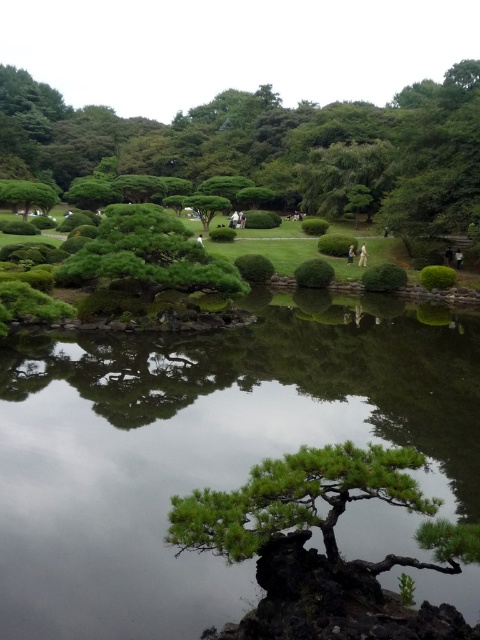
From the picture: Is green textured tree at center in front of green textured bush at center?

That is True.

Looking at this image, which of these two, green textured tree at center or green textured bush at center, stands taller?

With more height is green textured bush at center.

Between point (216, 506) and point (116, 209), which one is positioned behind?

Positioned behind is point (116, 209).

This screenshot has height=640, width=480. I want to click on green textured tree at center, so click(317, 508).

Is green leafy bush at upper center thinner than green textured tree at center?

Incorrect, green leafy bush at upper center's width is not less than green textured tree at center's.

Which is below, green leafy bush at upper center or green textured tree at center?

→ Positioned lower is green textured tree at center.

Between point (387, 122) and point (478, 552), which one is positioned behind?

Positioned behind is point (387, 122).

Locate an element on the screen. Image resolution: width=480 pixels, height=640 pixels. green leafy bush at upper center is located at coordinates (276, 147).

Can you confirm if green reflective water at center is smaller than green leafy bush at upper center?

Yes.

Is green reflective water at center positioned in front of green leafy bush at upper center?

Yes.

Is point (122, 596) closer to camera compared to point (427, 150)?

That is True.

Where is `green reflective water at center`? green reflective water at center is located at coordinates (204, 451).